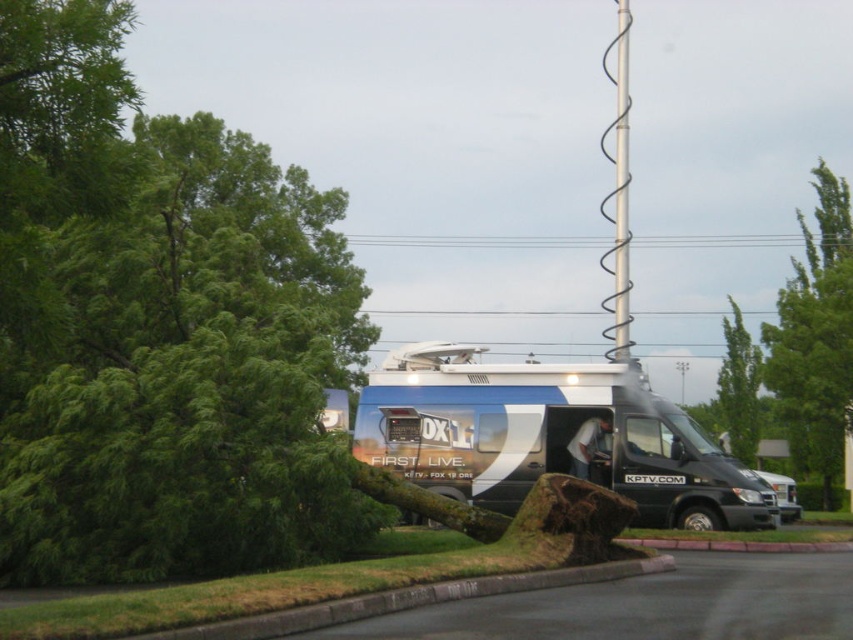
Question: Is green leafy tree at left to the left of metallic silver van at center from the viewer's perspective?

Choices:
 (A) yes
 (B) no

Answer: (A)

Question: Which of the following is the closest to the observer?

Choices:
 (A) black wire at upper center
 (B) green leafy tree at upper right

Answer: (B)

Question: Does metallic silver van at center lie in front of green leafy tree at upper right?

Choices:
 (A) yes
 (B) no

Answer: (A)

Question: Which point is closer to the camera taking this photo?

Choices:
 (A) (648, 490)
 (B) (619, 211)
 (C) (804, 308)
 (D) (519, 244)

Answer: (A)

Question: Which point appears farthest from the camera in this image?

Choices:
 (A) (497, 236)
 (B) (627, 13)
 (C) (405, 369)
 (D) (190, 516)

Answer: (B)

Question: Does green leafy tree at left lie in front of metallic silver van at center?

Choices:
 (A) no
 (B) yes

Answer: (B)